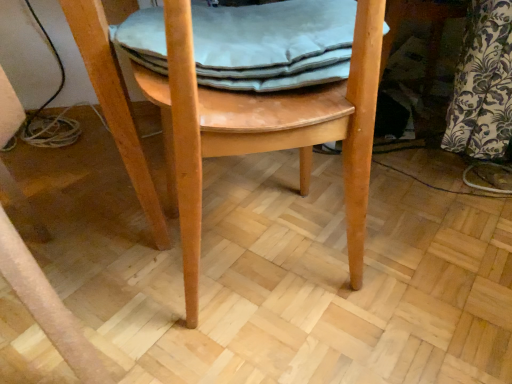
You are a GUI agent. You are given a task and a screenshot of the screen. Output one action in this format:
    pyautogui.click(x=<x>, y=<y>)
    Task: Click on the free area below light brown wood chair at center (from a real-world perspective)
    This screenshot has width=512, height=384.
    Given the screenshot: What is the action you would take?
    pyautogui.click(x=259, y=267)